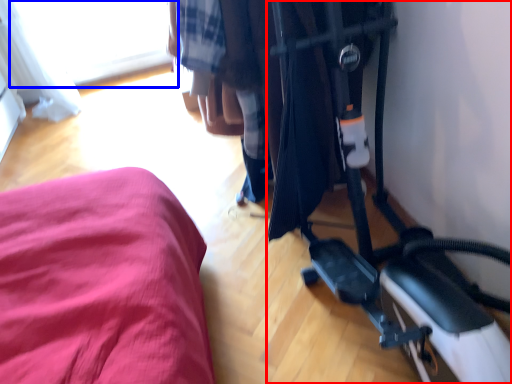
Question: Which point is further to the camera, baby carriage (highlighted by a red box) or window (highlighted by a blue box)?

Choices:
 (A) baby carriage
 (B) window

Answer: (B)